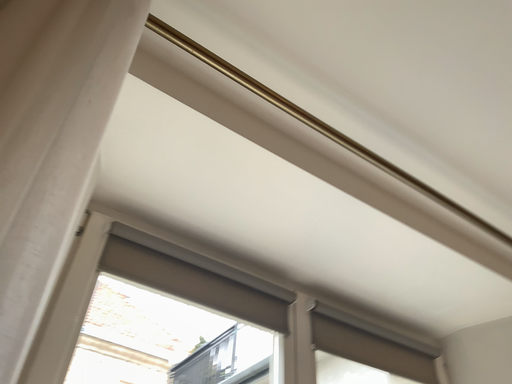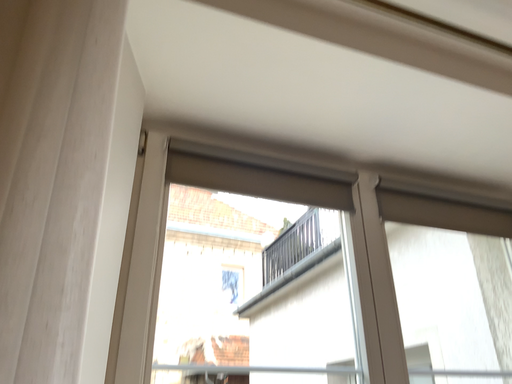
Question: How did the camera likely rotate when shooting the video?

Choices:
 (A) rotated downward
 (B) rotated upward

Answer: (A)